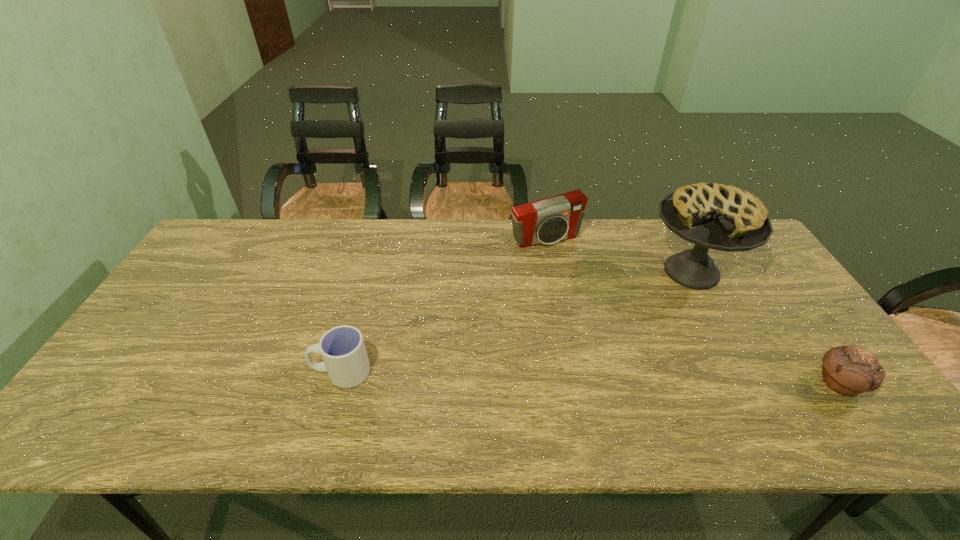
Locate an element on the screen. free space on the desktop that is between the leftmost object and the rightmost object and is positioned on the cut side of the tallest object is located at coordinates pyautogui.click(x=546, y=376).

Locate an element on the screen. This screenshot has width=960, height=540. vacant spot on the desktop that is between the leftmost object and the muffin and is positioned on the front-facing side of the camera is located at coordinates (636, 379).